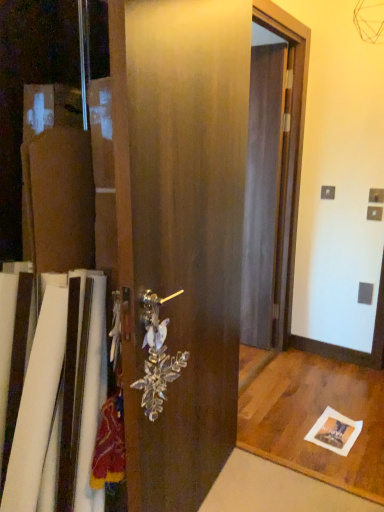
Question: Is satin wood barn door at center facing towards clear crystal door handle at center?

Choices:
 (A) yes
 (B) no

Answer: (A)

Question: Is satin wood barn door at center with clear crystal door handle at center?

Choices:
 (A) no
 (B) yes

Answer: (A)

Question: From a real-world perspective, is satin wood barn door at center on top of clear crystal door handle at center?

Choices:
 (A) no
 (B) yes

Answer: (B)

Question: Considering the relative sizes of satin wood barn door at center and clear crystal door handle at center in the image provided, is satin wood barn door at center smaller than clear crystal door handle at center?

Choices:
 (A) no
 (B) yes

Answer: (A)

Question: Is clear crystal door handle at center located within satin wood barn door at center?

Choices:
 (A) yes
 (B) no

Answer: (A)

Question: Based on their sizes in the image, would you say clear crystal door handle at center is bigger or smaller than transparent plastic screen door at center?

Choices:
 (A) small
 (B) big

Answer: (A)

Question: Considering the positions of clear crystal door handle at center and transparent plastic screen door at center in the image, is clear crystal door handle at center wider or thinner than transparent plastic screen door at center?

Choices:
 (A) wide
 (B) thin

Answer: (B)

Question: Is point (162, 328) positioned closer to the camera than point (279, 155)?

Choices:
 (A) closer
 (B) farther

Answer: (A)

Question: Is clear crystal door handle at center to the left or to the right of transparent plastic screen door at center in the image?

Choices:
 (A) right
 (B) left

Answer: (B)

Question: Choose the correct answer: Is transparent plastic screen door at center inside clear crystal door handle at center or outside it?

Choices:
 (A) inside
 (B) outside

Answer: (B)

Question: Considering the positions of point (273, 58) and point (165, 348), is point (273, 58) closer or farther from the camera than point (165, 348)?

Choices:
 (A) closer
 (B) farther

Answer: (B)

Question: From a real-world perspective, is transparent plastic screen door at center physically located above or below clear crystal door handle at center?

Choices:
 (A) above
 (B) below

Answer: (A)

Question: In the image, is transparent plastic screen door at center on the left side or the right side of clear crystal door handle at center?

Choices:
 (A) left
 (B) right

Answer: (B)

Question: Is point (140, 436) closer or farther from the camera than point (155, 328)?

Choices:
 (A) closer
 (B) farther

Answer: (B)

Question: In terms of size, does satin wood barn door at center appear bigger or smaller than clear crystal door handle at center?

Choices:
 (A) big
 (B) small

Answer: (A)